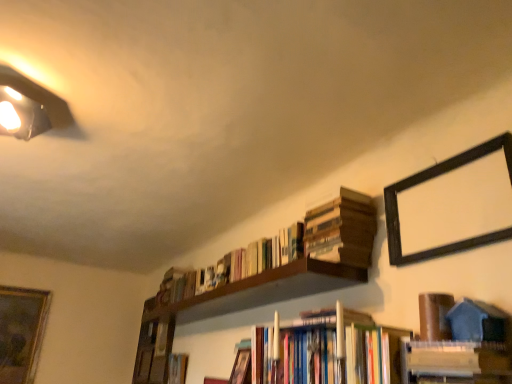
How much space does hardcover books at upper center, positioned as the fifth book in front-to-back order, occupy horizontally?

hardcover books at upper center, positioned as the fifth book in front-to-back order, is 2.13 inches in width.

The width and height of the screenshot is (512, 384). Identify the location of white glossy book at lower right, the 1th book positioned from the front. (457, 362).

Find the location of a particular element. This screenshot has height=384, width=512. wooden bookshelf at lower left is located at coordinates (154, 345).

Describe the element at coordinates (241, 368) in the screenshot. I see `hardcover book at center, arranged as the 2th book when viewed from the back` at that location.

The width and height of the screenshot is (512, 384). What do you see at coordinates (177, 368) in the screenshot?
I see `hardcover book at center, the seventh book positioned from the front` at bounding box center [177, 368].

Measure the distance between hardcover book at center, which is the 1th book from back to front, and camera.

hardcover book at center, which is the 1th book from back to front, is 2.69 meters away from camera.

The width and height of the screenshot is (512, 384). What do you see at coordinates (435, 316) in the screenshot?
I see `brown matte book at upper right, placed as the 3th book when sorted from front to back` at bounding box center [435, 316].

Measure the distance between black wood picture frame at upper right, which is the second picture frame in back-to-front order, and camera.

black wood picture frame at upper right, which is the second picture frame in back-to-front order, is 3.55 feet away from camera.

Where is `hardcover books at upper center, arranged as the third book when viewed from the back`? The height and width of the screenshot is (384, 512). hardcover books at upper center, arranged as the third book when viewed from the back is located at coordinates (234, 265).

Looking at this image, can you confirm if brown matte book at upper right, placed as the 3th book when sorted from front to back, is bigger than hardcover book at center, which is the 1th book from back to front?

Incorrect, brown matte book at upper right, placed as the 3th book when sorted from front to back, is not larger than hardcover book at center, which is the 1th book from back to front.

Between brown matte book at upper right, placed as the 3th book when sorted from front to back, and hardcover book at center, which is the 1th book from back to front, which one appears on the right side from the viewer's perspective?

brown matte book at upper right, placed as the 3th book when sorted from front to back.

Is brown matte book at upper right, placed as the 3th book when sorted from front to back, in contact with hardcover book at center, the seventh book positioned from the front?

No.

Is brown matte book at upper right, positioned as the 5th book in back-to-front order, located outside hardcover book at center, the seventh book positioned from the front?

Yes, brown matte book at upper right, positioned as the 5th book in back-to-front order, is outside of hardcover book at center, the seventh book positioned from the front.

Can you confirm if brown matte book at upper right, placed as the 3th book when sorted from front to back, is bigger than wooden book at upper right, placed as the fourth book when sorted from back to front?

No, brown matte book at upper right, placed as the 3th book when sorted from front to back, is not bigger than wooden book at upper right, placed as the fourth book when sorted from back to front.

From a real-world perspective, which object rests below the other?

brown matte book at upper right, positioned as the 5th book in back-to-front order, from a real-world perspective.

In the scene shown: How different are the orientations of brown matte book at upper right, placed as the 3th book when sorted from front to back, and wooden book at upper right, placed as the fourth book when sorted from back to front, in degrees?

There is a 5.63-degree angle between the facing directions of brown matte book at upper right, placed as the 3th book when sorted from front to back, and wooden book at upper right, placed as the fourth book when sorted from back to front.

Consider the image. Is brown matte book at upper right, positioned as the 5th book in back-to-front order, in front of wooden book at upper right, which is the 4th book from front to back?

Yes, the depth of brown matte book at upper right, positioned as the 5th book in back-to-front order, is less than that of wooden book at upper right, which is the 4th book from front to back.

Which is behind, white glossy book at lower right, the 1th book positioned from the front, or wooden bookshelf at lower left?

wooden bookshelf at lower left is more distant.

From a real-world perspective, is white glossy book at lower right, the 1th book positioned from the front, on wooden bookshelf at lower left?

Incorrect, from a real-world perspective, white glossy book at lower right, the 1th book positioned from the front, is lower than wooden bookshelf at lower left.

From the image's perspective, between white glossy book at lower right, placed as the seventh book when sorted from back to front, and wooden bookshelf at lower left, who is located below?

wooden bookshelf at lower left.

Can you confirm if white glossy book at lower right, placed as the seventh book when sorted from back to front, is bigger than wooden bookshelf at lower left?

Incorrect, white glossy book at lower right, placed as the seventh book when sorted from back to front, is not larger than wooden bookshelf at lower left.

From a real-world perspective, which is physically above, wooden bookshelf at lower left or gold-framed painting at lower left, which is the first picture frame from bottom to top?

wooden bookshelf at lower left is physically above.

At what (x,y) coordinates should I click in order to perform the action: click on picture frame that is behind the wooden bookshelf at lower left. Please return your answer as a coordinate pair (x, y). Looking at the image, I should click on (21, 332).

Considering the relative positions of wooden bookshelf at lower left and gold-framed painting at lower left, which is the first picture frame from bottom to top, in the image provided, is wooden bookshelf at lower left to the left or to the right of gold-framed painting at lower left, which is the first picture frame from bottom to top,?

In the image, wooden bookshelf at lower left appears on the right side of gold-framed painting at lower left, which is the first picture frame from bottom to top.

Which object is further away from the camera, wooden bookshelf at lower left or gold-framed painting at lower left, which is the first picture frame from bottom to top?

gold-framed painting at lower left, which is the first picture frame from bottom to top.

Is hardcover book at center, which is the 6th book in front-to-back order, outside of gold-framed painting at lower left, which is the first picture frame from bottom to top?

Yes, hardcover book at center, which is the 6th book in front-to-back order, is outside of gold-framed painting at lower left, which is the first picture frame from bottom to top.

Is hardcover book at center, which is the 6th book in front-to-back order, facing away from gold-framed painting at lower left, arranged as the second picture frame when viewed from the top?

No, hardcover book at center, which is the 6th book in front-to-back order,'s orientation is not away from gold-framed painting at lower left, arranged as the second picture frame when viewed from the top.

From the image's perspective, which one is positioned lower, hardcover book at center, arranged as the 2th book when viewed from the back, or gold-framed painting at lower left, arranged as the second picture frame when viewed from the top?

gold-framed painting at lower left, arranged as the second picture frame when viewed from the top, from the image's perspective.

Considering the relative positions of hardcover book at center, arranged as the 2th book when viewed from the back, and gold-framed painting at lower left, which is the first picture frame from bottom to top, in the image provided, is hardcover book at center, arranged as the 2th book when viewed from the back, to the left or to the right of gold-framed painting at lower left, which is the first picture frame from bottom to top,?

Based on their positions, hardcover book at center, arranged as the 2th book when viewed from the back, is located to the right of gold-framed painting at lower left, which is the first picture frame from bottom to top.

Is hardcover book at center, which is the 6th book in front-to-back order, taller or shorter than black wood picture frame at upper right, which is the first picture frame in top-to-bottom order?

In the image, hardcover book at center, which is the 6th book in front-to-back order, appears to be shorter than black wood picture frame at upper right, which is the first picture frame in top-to-bottom order.

Is hardcover book at center, which is the 6th book in front-to-back order, positioned with its back to black wood picture frame at upper right, acting as the second picture frame starting from the bottom?

hardcover book at center, which is the 6th book in front-to-back order, is not turned away from black wood picture frame at upper right, acting as the second picture frame starting from the bottom.

Is hardcover book at center, arranged as the 2th book when viewed from the back, next to black wood picture frame at upper right, the first picture frame from the front?

No, hardcover book at center, arranged as the 2th book when viewed from the back, is not next to black wood picture frame at upper right, the first picture frame from the front.

Would you say hardcover book at center, which is the 6th book in front-to-back order, is outside black wood picture frame at upper right, which is counted as the first picture frame, starting from the right?

Indeed, hardcover book at center, which is the 6th book in front-to-back order, is completely outside black wood picture frame at upper right, which is counted as the first picture frame, starting from the right.

Between gold-framed painting at lower left, arranged as the 1th picture frame when viewed from the back, and brown matte book at upper right, placed as the 3th book when sorted from front to back, which one appears on the right side from the viewer's perspective?

From the viewer's perspective, brown matte book at upper right, placed as the 3th book when sorted from front to back, appears more on the right side.

From the picture: From a real-world perspective, is gold-framed painting at lower left, arranged as the second picture frame when viewed from the top, physically located above or below brown matte book at upper right, placed as the 3th book when sorted from front to back?

In terms of real-world spatial position, gold-framed painting at lower left, arranged as the second picture frame when viewed from the top, is above brown matte book at upper right, placed as the 3th book when sorted from front to back.

Considering the relative sizes of gold-framed painting at lower left, arranged as the 1th picture frame when viewed from the back, and brown matte book at upper right, positioned as the 5th book in back-to-front order, in the image provided, is gold-framed painting at lower left, arranged as the 1th picture frame when viewed from the back, shorter than brown matte book at upper right, positioned as the 5th book in back-to-front order,?

No.

Is gold-framed painting at lower left, which is the first picture frame from bottom to top, positioned beyond the bounds of brown matte book at upper right, positioned as the 5th book in back-to-front order?

gold-framed painting at lower left, which is the first picture frame from bottom to top, is positioned outside brown matte book at upper right, positioned as the 5th book in back-to-front order.

Where is `book that is the 4th object located behind the brown matte book at upper right, placed as the 3th book when sorted from front to back`? This screenshot has height=384, width=512. book that is the 4th object located behind the brown matte book at upper right, placed as the 3th book when sorted from front to back is located at coordinates (177, 368).

Find the location of `book that is the 1st one when counting forward from the wooden book at upper right, placed as the fourth book when sorted from back to front`. book that is the 1st one when counting forward from the wooden book at upper right, placed as the fourth book when sorted from back to front is located at coordinates click(x=435, y=316).

Based on their spatial positions, is hardcover book at center, which is the 6th book in front-to-back order, or brown matte book at upper right, positioned as the 5th book in back-to-front order, closer to hardcover books at center, which ranks as the 2th book in front-to-back order?

Based on the image, hardcover book at center, which is the 6th book in front-to-back order, appears to be nearer to hardcover books at center, which ranks as the 2th book in front-to-back order.

Considering their positions, is wooden bookshelf at lower left positioned closer to white glossy book at lower right, the 1th book positioned from the front, than hardcover book at center, which is the 6th book in front-to-back order?

hardcover book at center, which is the 6th book in front-to-back order, is closer to white glossy book at lower right, the 1th book positioned from the front.

When comparing their distances from hardcover book at center, which is the 6th book in front-to-back order, does brown matte book at upper right, placed as the 3th book when sorted from front to back, or black wood picture frame at upper right, which is counted as the first picture frame, starting from the right, seem further?

black wood picture frame at upper right, which is counted as the first picture frame, starting from the right, lies further to hardcover book at center, which is the 6th book in front-to-back order, than the other object.

When comparing their distances from brown matte book at upper right, placed as the 3th book when sorted from front to back, does wooden book at upper right, placed as the fourth book when sorted from back to front, or hardcover books at upper center, positioned as the fifth book in front-to-back order, seem further?

hardcover books at upper center, positioned as the fifth book in front-to-back order, is positioned further to the anchor brown matte book at upper right, placed as the 3th book when sorted from front to back.

Estimate the real-world distances between objects in this image. Which object is further from hardcover book at center, the seventh book positioned from the front, brown matte book at upper right, positioned as the 5th book in back-to-front order, or wooden book at upper right, placed as the fourth book when sorted from back to front?

brown matte book at upper right, positioned as the 5th book in back-to-front order, lies further to hardcover book at center, the seventh book positioned from the front, than the other object.

Which object lies nearer to the anchor point white glossy book at lower right, the 1th book positioned from the front, gold-framed painting at lower left, arranged as the second picture frame when viewed from the top, or black wood picture frame at upper right, which is the second picture frame in back-to-front order?

black wood picture frame at upper right, which is the second picture frame in back-to-front order, lies closer to white glossy book at lower right, the 1th book positioned from the front, than the other object.

Considering their positions, is brown matte book at upper right, positioned as the 5th book in back-to-front order, positioned closer to wooden bookshelf at lower left than hardcover book at center, arranged as the 2th book when viewed from the back?

hardcover book at center, arranged as the 2th book when viewed from the back, is positioned closer to the anchor wooden bookshelf at lower left.

Based on their spatial positions, is hardcover books at center, the 6th book from the back, or black wood picture frame at upper right, which is the first picture frame in top-to-bottom order, closer to wooden bookshelf at lower left?

The object closer to wooden bookshelf at lower left is hardcover books at center, the 6th book from the back.

Where is `shelf between gold-framed painting at lower left, the 1th picture frame positioned from the left, and black wood picture frame at upper right, which is the second picture frame in back-to-front order, from left to right`? This screenshot has height=384, width=512. shelf between gold-framed painting at lower left, the 1th picture frame positioned from the left, and black wood picture frame at upper right, which is the second picture frame in back-to-front order, from left to right is located at coordinates click(154, 345).

At what (x,y) coordinates should I click in order to perform the action: click on shelf between gold-framed painting at lower left, the 1th picture frame positioned from the left, and hardcover book at center, the seventh book positioned from the front. Please return your answer as a coordinate pair (x, y). The image size is (512, 384). Looking at the image, I should click on (154, 345).

Image resolution: width=512 pixels, height=384 pixels. In order to click on book between gold-framed painting at lower left, which is the first picture frame from bottom to top, and hardcover books at upper center, arranged as the third book when viewed from the back in this screenshot , I will do `click(177, 368)`.

What are the coordinates of `shelf between white glossy book at lower right, placed as the seventh book when sorted from back to front, and gold-framed painting at lower left, arranged as the 1th picture frame when viewed from the back, from front to back` in the screenshot? It's located at (154, 345).